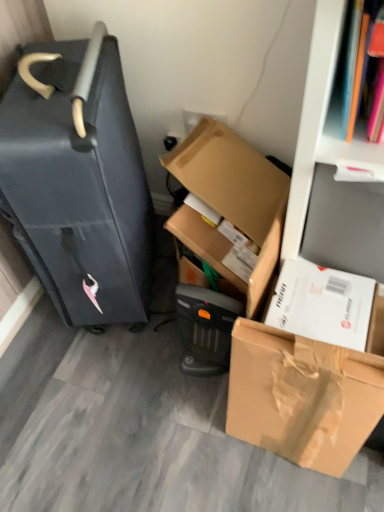
Question: From a real-world perspective, is brown cardboard box at lower right, which is the first box in bottom-to-top order, positioned under matte black suitcase at left based on gravity?

Choices:
 (A) no
 (B) yes

Answer: (B)

Question: Is matte black suitcase at left inside brown cardboard box at lower right, the second box positioned from the top?

Choices:
 (A) yes
 (B) no

Answer: (B)

Question: Can you confirm if brown cardboard box at lower right, the second box positioned from the top, is positioned to the left of matte black suitcase at left?

Choices:
 (A) yes
 (B) no

Answer: (B)

Question: Is brown cardboard box at lower right, the second box positioned from the top, outside matte black suitcase at left?

Choices:
 (A) yes
 (B) no

Answer: (A)

Question: From a real-world perspective, is brown cardboard box at lower right, the second box positioned from the top, physically above matte black suitcase at left?

Choices:
 (A) yes
 (B) no

Answer: (B)

Question: Is point (89, 321) closer or farther from the camera than point (269, 431)?

Choices:
 (A) closer
 (B) farther

Answer: (B)

Question: Considering the positions of matte black suitcase at left and brown cardboard box at lower right, the second box positioned from the top, in the image, is matte black suitcase at left taller or shorter than brown cardboard box at lower right, the second box positioned from the top,?

Choices:
 (A) tall
 (B) short

Answer: (A)

Question: In the image, is matte black suitcase at left positioned in front of or behind brown cardboard box at lower right, the second box positioned from the top?

Choices:
 (A) front
 (B) behind

Answer: (B)

Question: From a real-world perspective, is matte black suitcase at left above or below brown cardboard box at lower right, the second box positioned from the top?

Choices:
 (A) above
 (B) below

Answer: (A)

Question: Considering the positions of cardboard box at center, which is the first box in top-to-bottom order, and matte black suitcase at left in the image, is cardboard box at center, which is the first box in top-to-bottom order, bigger or smaller than matte black suitcase at left?

Choices:
 (A) big
 (B) small

Answer: (B)

Question: In terms of width, does cardboard box at center, which ranks as the 2th box in bottom-to-top order, look wider or thinner when compared to matte black suitcase at left?

Choices:
 (A) wide
 (B) thin

Answer: (A)

Question: Would you say cardboard box at center, which is the first box in top-to-bottom order, is inside or outside matte black suitcase at left?

Choices:
 (A) inside
 (B) outside

Answer: (B)

Question: From a real-world perspective, relative to matte black suitcase at left, is cardboard box at center, which ranks as the 2th box in bottom-to-top order, vertically above or below?

Choices:
 (A) below
 (B) above

Answer: (A)

Question: From a real-world perspective, is brown cardboard box at lower right, which is the first box in bottom-to-top order, above or below matte black suitcase at left?

Choices:
 (A) above
 (B) below

Answer: (B)

Question: Is brown cardboard box at lower right, which is the first box in bottom-to-top order, in front of or behind matte black suitcase at left in the image?

Choices:
 (A) behind
 (B) front

Answer: (B)